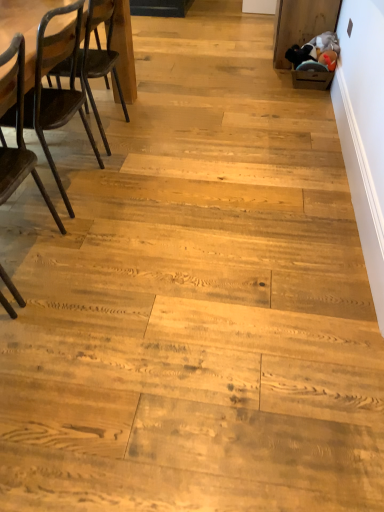
Identify the location of vacant space to the right of dark brown wood chair at left, positioned as the 2th chair in front-to-back order. (146, 190).